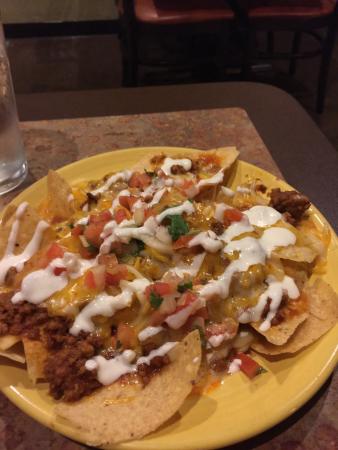
You are a GUI agent. You are given a task and a screenshot of the screen. Output one action in this format:
    pyautogui.click(x=<x>, y=<y>)
    Task: Click on the water glass
    
    Given the screenshot: What is the action you would take?
    pyautogui.click(x=9, y=142)